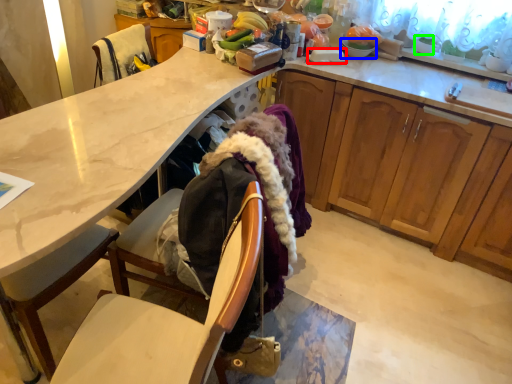
Question: Considering the real-world distances, which object is closest to plate (highlighted by a red box)? tableware (highlighted by a blue box) or houseplant (highlighted by a green box).

Choices:
 (A) tableware
 (B) houseplant

Answer: (A)